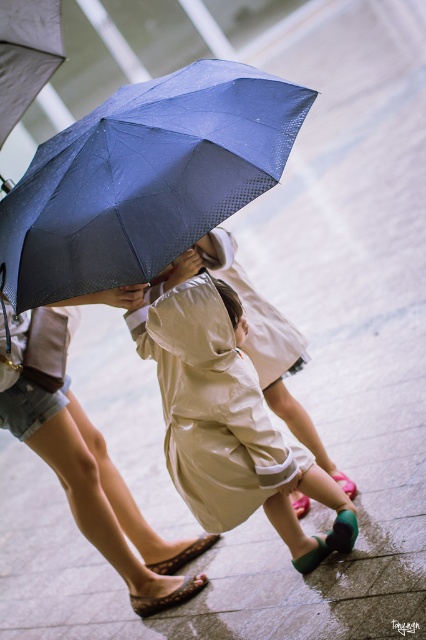
Based on the photo, can you confirm if matte blue umbrella at center is positioned to the left of beige satin raincoat at center?

Indeed, matte blue umbrella at center is positioned on the left side of beige satin raincoat at center.

Does matte blue umbrella at center have a smaller size compared to beige satin raincoat at center?

Incorrect, matte blue umbrella at center is not smaller in size than beige satin raincoat at center.

Between point (57, 260) and point (184, 285), which one is positioned in front?

Point (57, 260) is in front.

Locate an element on the screen. This screenshot has height=640, width=426. matte blue umbrella at center is located at coordinates (144, 179).